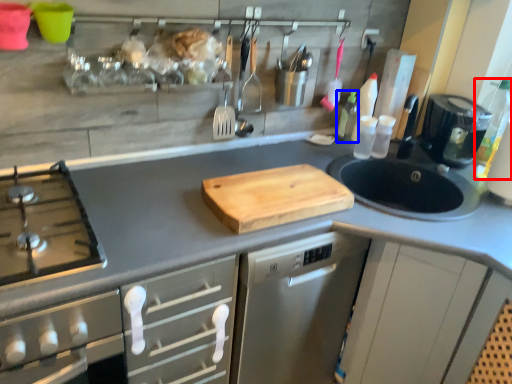
Question: Which of the following is the farthest to the observer, bottle (highlighted by a red box) or bottle (highlighted by a blue box)?

Choices:
 (A) bottle
 (B) bottle

Answer: (B)